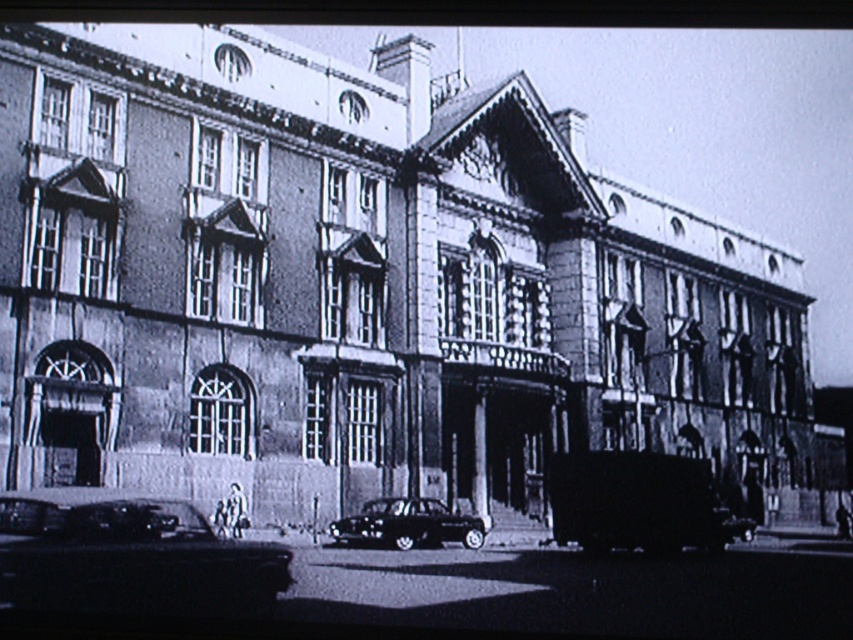
Is point (270, 566) positioned before point (381, 529)?

Yes, point (270, 566) is in front of point (381, 529).

Which is more to the left, shiny black car at lower left or shiny black car at center?

shiny black car at lower left

Who is more distant from viewer, [198,540] or [358,540]?

Point [358,540]

Locate an element on the screen. This screenshot has width=853, height=640. shiny black car at lower left is located at coordinates (131, 557).